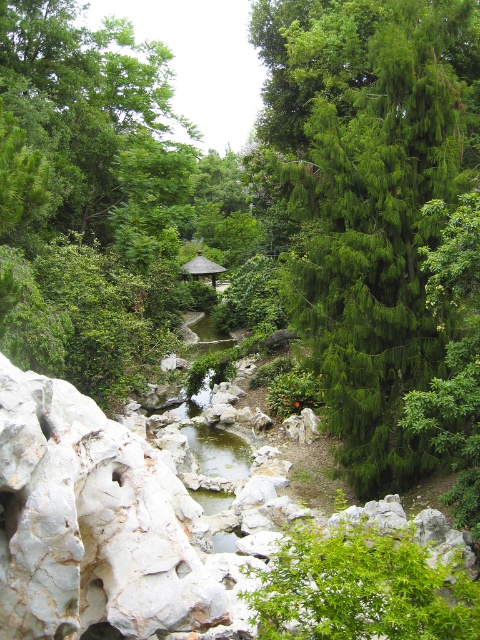
Question: Considering the relative positions of green needle-like tree at center-right and wooden thatched roof gazebo at center in the image provided, where is green needle-like tree at center-right located with respect to wooden thatched roof gazebo at center?

Choices:
 (A) below
 (B) above

Answer: (B)

Question: Among these points, which one is farthest from the camera?

Choices:
 (A) (396, 598)
 (B) (360, 342)
 (C) (199, 257)
 (D) (109, 488)

Answer: (C)

Question: From the image, what is the correct spatial relationship of green needle-like tree at center-right in relation to green leafy bush at center?

Choices:
 (A) below
 (B) above

Answer: (B)

Question: Estimate the real-world distances between objects in this image. Which object is farther from the wooden thatched roof gazebo at center?

Choices:
 (A) green leafy bush at center
 (B) green needle-like tree at center-right

Answer: (A)

Question: Is white marble rock at center positioned behind green leafy bush at center?

Choices:
 (A) yes
 (B) no

Answer: (A)

Question: Estimate the real-world distances between objects in this image. Which object is farther from the white marble rock at center?

Choices:
 (A) green leafy bush at center
 (B) wooden thatched roof gazebo at center
 (C) green needle-like tree at center-right

Answer: (B)